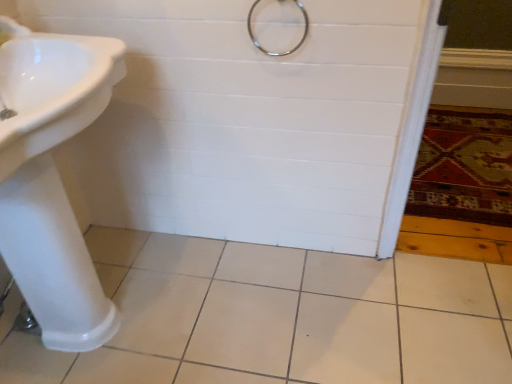
What are the coordinates of `metallic ring at upper center` in the screenshot? It's located at (278, 53).

What do you see at coordinates (281, 317) in the screenshot? I see `white ceramic tile at center` at bounding box center [281, 317].

What do you see at coordinates (52, 178) in the screenshot? This screenshot has width=512, height=384. I see `white glossy sink at left` at bounding box center [52, 178].

I want to click on metallic ring at upper center, so click(278, 53).

From a real-world perspective, relative to white glossy sink at left, is white ceramic tile at center vertically above or below?

Clearly, from a real-world perspective, white ceramic tile at center is below white glossy sink at left.

Find the location of a particular element. ceramic tile behind the white glossy sink at left is located at coordinates (281, 317).

Which is more to the left, white ceramic tile at center or white glossy sink at left?

white glossy sink at left.

Between white ceramic tile at center and white glossy sink at left, which one has smaller width?

white glossy sink at left is thinner.

Which is behind, point (306, 19) or point (439, 108)?

The point (439, 108) is more distant.

From the image's perspective, is metallic ring at upper center positioned above or below carpeted rug at lower right?

Clearly, from the image's perspective, metallic ring at upper center is above carpeted rug at lower right.

This screenshot has width=512, height=384. Identify the location of shower located in front of the carpeted rug at lower right. (278, 53).

The width and height of the screenshot is (512, 384). What are the coordinates of `bath mat on the right of white ceramic tile at center` in the screenshot? It's located at (464, 166).

Between white ceramic tile at center and carpeted rug at lower right, which one has smaller width?

With smaller width is white ceramic tile at center.

Is point (181, 290) behind point (437, 165)?

No, (181, 290) is in front of (437, 165).

Consider the image. Would you say white ceramic tile at center contains carpeted rug at lower right?

No, carpeted rug at lower right is not inside white ceramic tile at center.

Is white glossy sink at left at the back of carpeted rug at lower right?

No, white glossy sink at left is not at the back of carpeted rug at lower right.

Can you tell me how much carpeted rug at lower right and white glossy sink at left differ in facing direction?

The angle between the facing direction of carpeted rug at lower right and the facing direction of white glossy sink at left is 92.9 degrees.

Is there a large distance between carpeted rug at lower right and white glossy sink at left?

Yes, carpeted rug at lower right and white glossy sink at left are located far from each other.

Considering the sizes of objects carpeted rug at lower right and white glossy sink at left in the image provided, who is smaller, carpeted rug at lower right or white glossy sink at left?

With smaller size is carpeted rug at lower right.

From the image's perspective, which object appears higher, white glossy sink at left or metallic ring at upper center?

metallic ring at upper center appears higher in the image.

Looking at this image, how different are the orientations of white glossy sink at left and metallic ring at upper center in degrees?

They differ by 89.9 degrees in their facing directions.

Can you see white glossy sink at left touching metallic ring at upper center?

white glossy sink at left is not next to metallic ring at upper center, and they're not touching.

Considering the sizes of objects white glossy sink at left and metallic ring at upper center in the image provided, who is shorter, white glossy sink at left or metallic ring at upper center?

Standing shorter between the two is metallic ring at upper center.

Is carpeted rug at lower right completely or partially outside of white ceramic tile at center?

Yes, carpeted rug at lower right is not within white ceramic tile at center.

Is carpeted rug at lower right looking in the opposite direction of white ceramic tile at center?

No, white ceramic tile at center is not at the back of carpeted rug at lower right.

Is carpeted rug at lower right placed right next to white ceramic tile at center?

No, carpeted rug at lower right is not touching white ceramic tile at center.

Is carpeted rug at lower right inside or outside of metallic ring at upper center?

carpeted rug at lower right is located beyond the bounds of metallic ring at upper center.

Can you tell me how much carpeted rug at lower right and metallic ring at upper center differ in facing direction?

2.96 degrees.

From the picture: Are carpeted rug at lower right and metallic ring at upper center beside each other?

carpeted rug at lower right and metallic ring at upper center are clearly separated.

Considering the sizes of objects carpeted rug at lower right and metallic ring at upper center in the image provided, who is wider, carpeted rug at lower right or metallic ring at upper center?

With larger width is carpeted rug at lower right.

This screenshot has width=512, height=384. Identify the location of sink on the left of the white ceramic tile at center. (52, 178).

What are the coordinates of `bath mat below the metallic ring at upper center (from a real-world perspective)` in the screenshot? It's located at (464, 166).

Considering their positions, is metallic ring at upper center positioned closer to carpeted rug at lower right than white glossy sink at left?

metallic ring at upper center.

Estimate the real-world distances between objects in this image. Which object is closer to white ceramic tile at center, metallic ring at upper center or white glossy sink at left?

white glossy sink at left is closer to white ceramic tile at center.

From the image, which object appears to be farther from white glossy sink at left, metallic ring at upper center or white ceramic tile at center?

metallic ring at upper center lies further to white glossy sink at left than the other object.

Looking at the image, which one is located closer to carpeted rug at lower right, white ceramic tile at center or metallic ring at upper center?

The object closer to carpeted rug at lower right is white ceramic tile at center.

Which object lies nearer to the anchor point metallic ring at upper center, carpeted rug at lower right or white ceramic tile at center?

white ceramic tile at center is positioned closer to the anchor metallic ring at upper center.

Which object lies further to the anchor point metallic ring at upper center, carpeted rug at lower right or white glossy sink at left?

carpeted rug at lower right.

Which object lies further to the anchor point metallic ring at upper center, white ceramic tile at center or carpeted rug at lower right?

carpeted rug at lower right is further to metallic ring at upper center.

Based on their spatial positions, is carpeted rug at lower right or white glossy sink at left further from white ceramic tile at center?

The object further to white ceramic tile at center is carpeted rug at lower right.

Locate an element on the screen. The width and height of the screenshot is (512, 384). ceramic tile between metallic ring at upper center and carpeted rug at lower right in the horizontal direction is located at coordinates (281, 317).

Image resolution: width=512 pixels, height=384 pixels. Find the location of `shower situated between white glossy sink at left and carpeted rug at lower right from left to right`. shower situated between white glossy sink at left and carpeted rug at lower right from left to right is located at coordinates (278, 53).

This screenshot has height=384, width=512. In order to click on sink between metallic ring at upper center and white ceramic tile at center from top to bottom in this screenshot , I will do `click(52, 178)`.

Identify the location of ceramic tile situated between white glossy sink at left and carpeted rug at lower right from left to right. This screenshot has width=512, height=384. (281, 317).